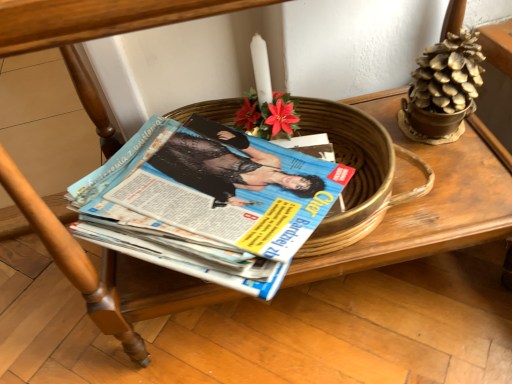
Question: From the image's perspective, is blue glossy magazine at center located above or below gold metallic flowerpot at upper right?

Choices:
 (A) below
 (B) above

Answer: (A)

Question: Considering the relative positions of blue glossy magazine at center and gold metallic flowerpot at upper right in the image provided, is blue glossy magazine at center to the left or to the right of gold metallic flowerpot at upper right?

Choices:
 (A) left
 (B) right

Answer: (A)

Question: Which of these objects is positioned farthest from the gold metallic pinecone at upper right?

Choices:
 (A) blue glossy magazine at center
 (B) gold metallic flowerpot at upper right

Answer: (A)

Question: Which of these objects is positioned farthest from the gold metallic pinecone at upper right?

Choices:
 (A) blue glossy magazine at center
 (B) gold metallic flowerpot at upper right

Answer: (A)